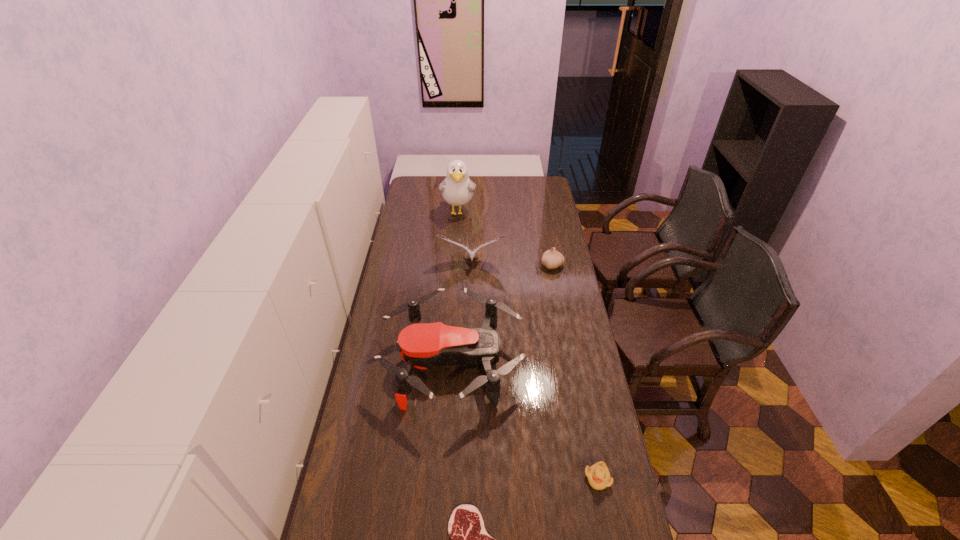
Where is `vacant space located 0.370m on the left of the fourth tallest object`? vacant space located 0.370m on the left of the fourth tallest object is located at coordinates (463, 265).

Where is `object present at the left edge`? The image size is (960, 540). object present at the left edge is located at coordinates (421, 345).

At what (x,y) coordinates should I click in order to perform the action: click on garlic located at the right edge. Please return your answer as a coordinate pair (x, y). This screenshot has height=540, width=960. Looking at the image, I should click on (551, 259).

I want to click on duckling that is positioned at the right edge, so click(598, 475).

Find the location of `vacant space at the far edge of the desktop`. vacant space at the far edge of the desktop is located at coordinates 506,183.

This screenshot has height=540, width=960. I want to click on free space at the left edge of the desktop, so click(x=426, y=230).

At what (x,y) coordinates should I click in order to perform the action: click on vacant space at the right edge. Please return your answer as a coordinate pair (x, y). Image resolution: width=960 pixels, height=540 pixels. Looking at the image, I should click on (540, 231).

Locate an element on the screen. free point between the nearer gull and the third nearest object is located at coordinates (463, 313).

I want to click on vacant area that lies between the shorter gull and the fourth tallest object, so click(513, 265).

What are the coordinates of `empty space that is in between the fifth farthest object and the tallest object` in the screenshot? It's located at (528, 345).